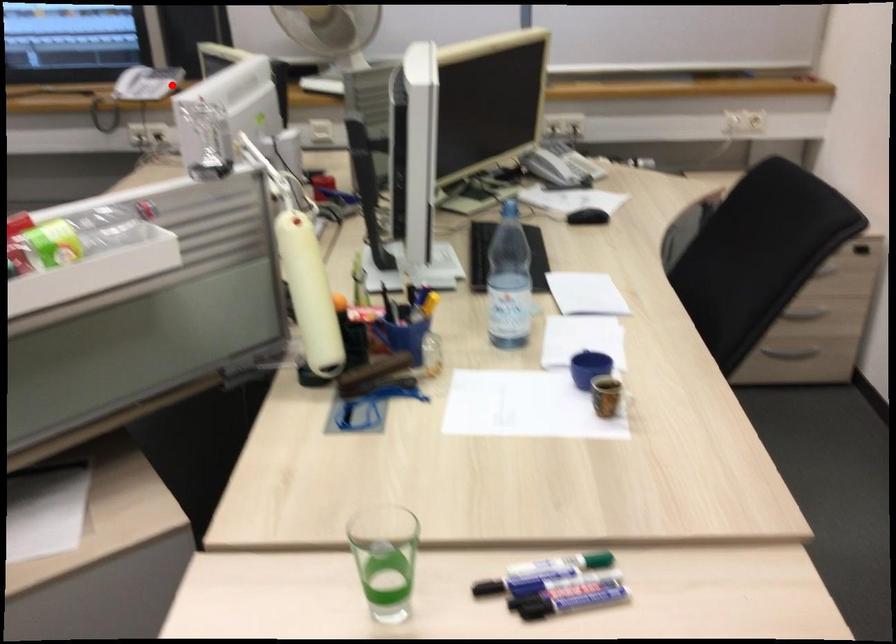
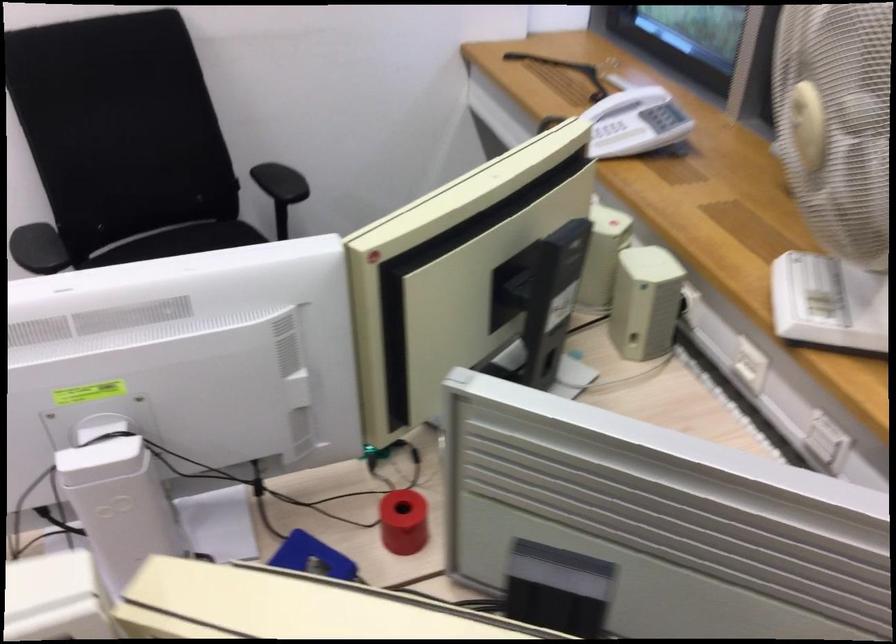
In the second image, find the point that corresponds to the highlighted location in the first image.

(634, 122)